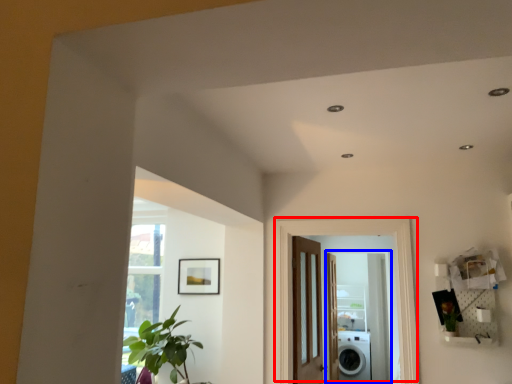
Question: Which object is closer to the camera taking this photo, door (highlighted by a red box) or screen door (highlighted by a blue box)?

Choices:
 (A) door
 (B) screen door

Answer: (A)